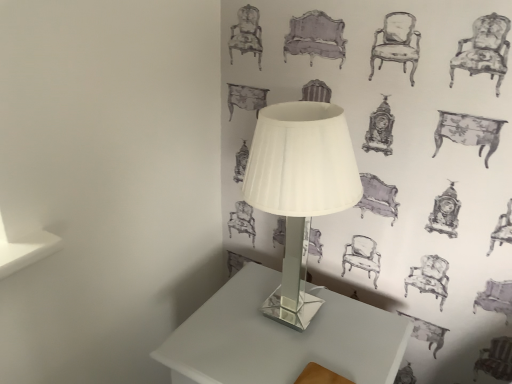
Locate an element on the screen. This screenshot has height=384, width=512. vacant area situated to the left side of white glass lamp at center is located at coordinates (215, 325).